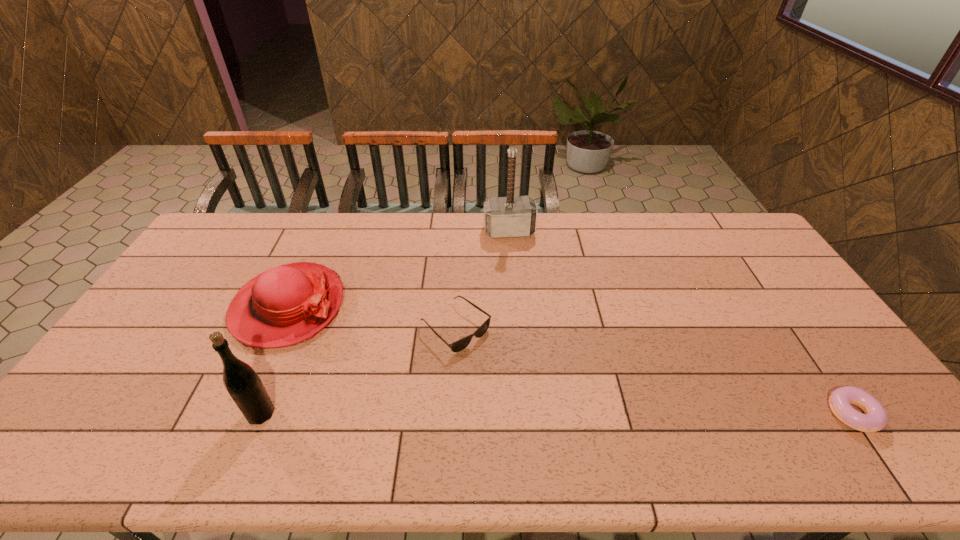
The height and width of the screenshot is (540, 960). Identify the location of empty space that is in between the hammer and the sunglasses. (482, 279).

Identify the location of vacant region between the doughnut and the beer bottle. (557, 414).

Image resolution: width=960 pixels, height=540 pixels. I want to click on vacant point located between the hammer and the sunglasses, so click(482, 279).

Locate an element on the screen. The height and width of the screenshot is (540, 960). empty space between the hammer and the rightmost object is located at coordinates (681, 322).

Find the location of a particular element. This screenshot has width=960, height=540. empty space that is in between the farthest object and the doughnut is located at coordinates (681, 322).

Where is `free spot between the rightmost object and the sunglasses`? The width and height of the screenshot is (960, 540). free spot between the rightmost object and the sunglasses is located at coordinates (654, 370).

Locate an element on the screen. The width and height of the screenshot is (960, 540). free space between the beer bottle and the rightmost object is located at coordinates (557, 414).

Find the location of a particular element. This screenshot has width=960, height=540. object that is the closest to the sunglasses is located at coordinates (283, 306).

Locate which object ranks second in proximity to the sunglasses. Please provide its 2D coordinates. Your answer should be formatted as a tuple, i.e. [(x, y)], where the tuple contains the x and y coordinates of a point satisfying the conditions above.

[(510, 216)]

Where is `vacant region that satisfies the following two spatial constraints: 1. on the front side of the hammer; 2. on the right side of the rightmost object`? This screenshot has width=960, height=540. vacant region that satisfies the following two spatial constraints: 1. on the front side of the hammer; 2. on the right side of the rightmost object is located at coordinates (524, 414).